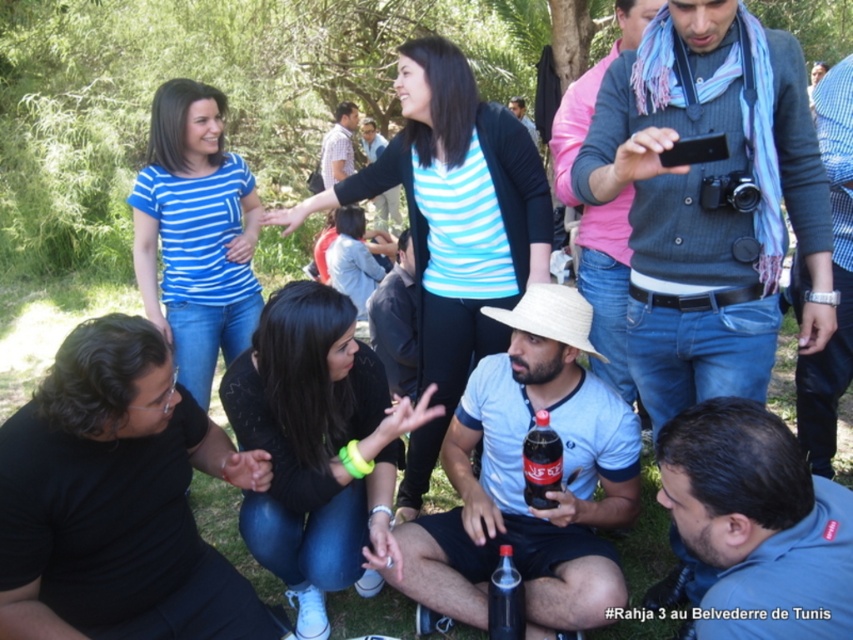
You are organizing a charity event and need to determine clothing sizes for participants. You observe two shirts in the image, the light blue cotton shirt at center and the white striped shirt at upper center. Which shirt has a larger size?

The light blue cotton shirt at center has a larger size than the white striped shirt at upper center because its width is greater.

You are standing at the entrance of the park and want to find the light blue cotton shirt at center. According to the coordinates provided, in which direction should you look to locate it?

The light blue cotton shirt at center is located at coordinates point (521,477), which means you should look towards the lower right direction from your current position at the entrance to find it.